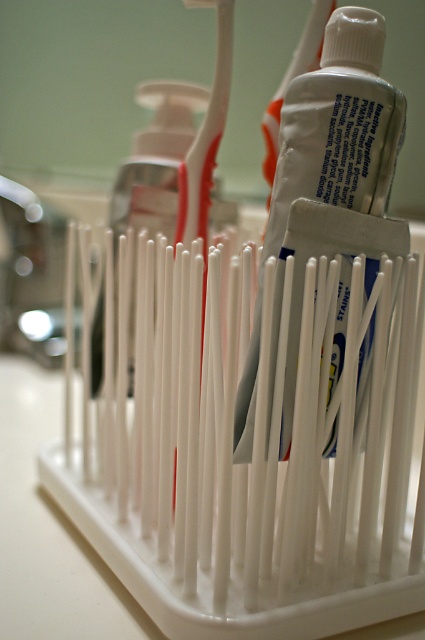
Between white plastic toothbrush at center and white plastic toothbrush at upper center, which one appears on the right side from the viewer's perspective?

white plastic toothbrush at upper center is more to the right.

Which is in front, point (195, 161) or point (314, 16)?

Point (195, 161)

In order to click on white plastic toothbrush at center in this screenshot , I will do `click(206, 136)`.

Is white glossy tube of toothpaste at center positioned before white plastic toothbrush at center?

Yes.

Based on the photo, measure the distance between point (346,122) and camera.

64.89 centimeters

Locate an element on the screen. white glossy tube of toothpaste at center is located at coordinates (339, 125).

Is white glossy tube of toothpaste at center taller than white plastic toothbrush at upper center?

Yes, white glossy tube of toothpaste at center is taller than white plastic toothbrush at upper center.

From the picture: Between white glossy tube of toothpaste at center and white plastic toothbrush at upper center, which one has more height?

white glossy tube of toothpaste at center is taller.

Image resolution: width=425 pixels, height=640 pixels. What do you see at coordinates (339, 125) in the screenshot? I see `white glossy tube of toothpaste at center` at bounding box center [339, 125].

This screenshot has height=640, width=425. I want to click on white glossy tube of toothpaste at center, so click(x=339, y=125).